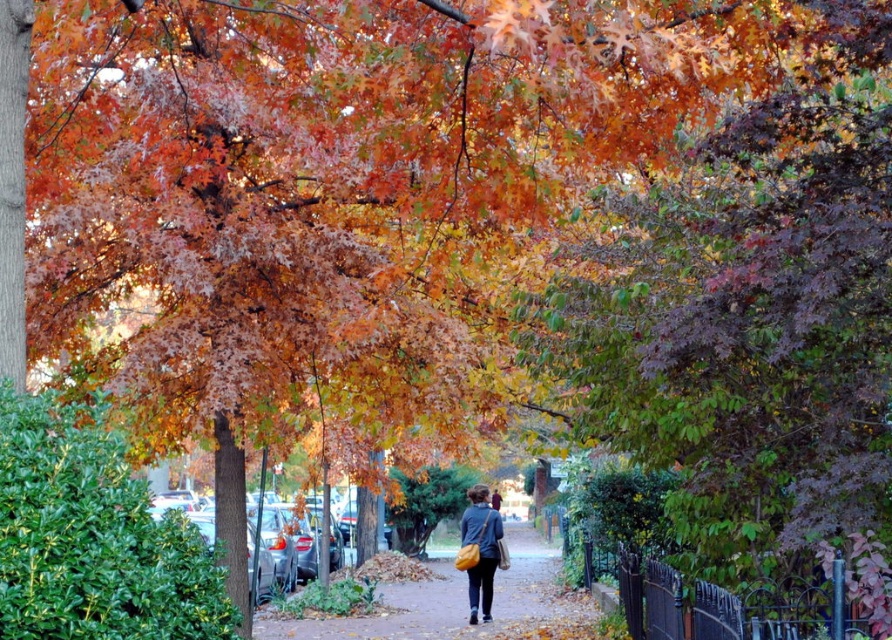
Does brown textured sidewalk at center have a lesser height compared to matte yellow bag at center?

Yes, brown textured sidewalk at center is shorter than matte yellow bag at center.

What do you see at coordinates (455, 602) in the screenshot?
I see `brown textured sidewalk at center` at bounding box center [455, 602].

At what (x,y) coordinates should I click in order to perform the action: click on brown textured sidewalk at center. Please return your answer as a coordinate pair (x, y). This screenshot has height=640, width=892. Looking at the image, I should click on (455, 602).